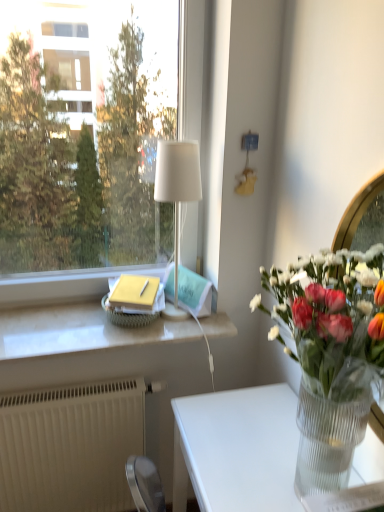
At what (x,y) coordinates should I click in order to perform the action: click on free spot above transparent glass vase at lower right (from a real-world perspective). Please return your answer as a coordinate pair (x, y). Image resolution: width=384 pixels, height=512 pixels. Looking at the image, I should click on (248, 436).